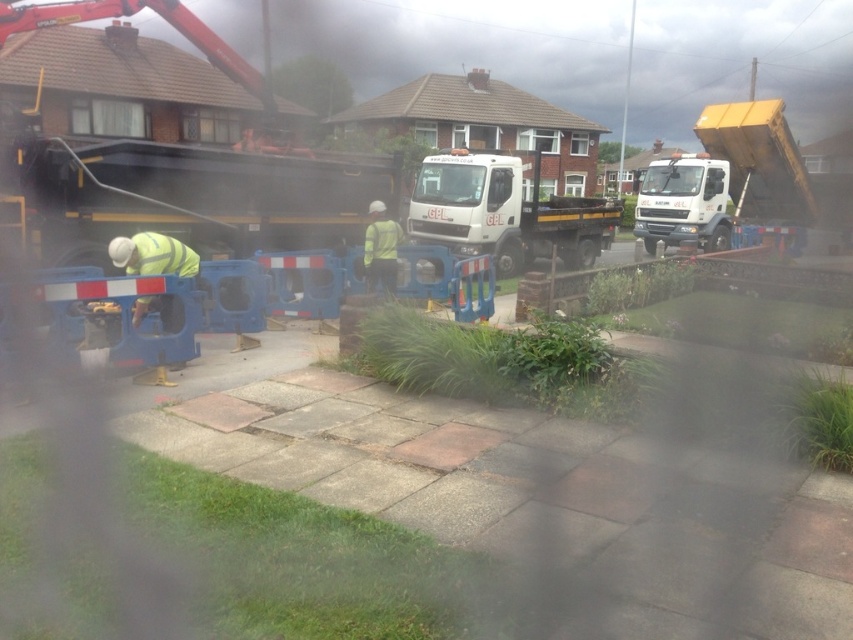
You are a delivery driver approaching the construction site. You see two points marked as point 1 at coordinates (x=666, y=422) and point 2 at coordinates (x=480, y=195). Which point should you avoid to stay clear of the construction area?

You should avoid point 1 at coordinates (x=666, y=422) because it is in front of point 2 at coordinates (x=480, y=195), meaning it is closer to the construction zone.

You are a delivery driver approaching the construction site and need to navigate around the blue plastic barrier at center and the white matte truck at center. Based on their sizes, which object should you avoid hitting first to ensure your vehicle can pass safely?

The blue plastic barrier at center is not as tall as the white matte truck at center, so you should avoid hitting the white matte truck at center first since it is taller and could cause more damage or block the path.